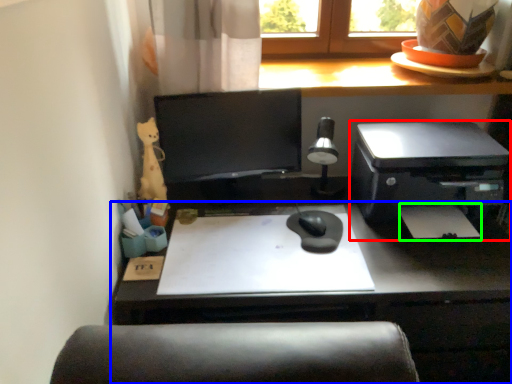
Question: Which object is the closest to the printer (highlighted by a red box)? Choose among these: desk (highlighted by a blue box) or notepad (highlighted by a green box).

Choices:
 (A) desk
 (B) notepad

Answer: (B)